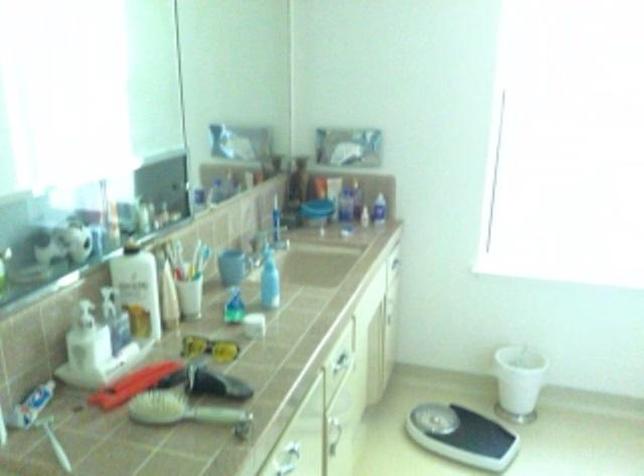
Where would you press the white dispenser pump? Please return your answer as a coordinate pair (x, y).

(87, 339)